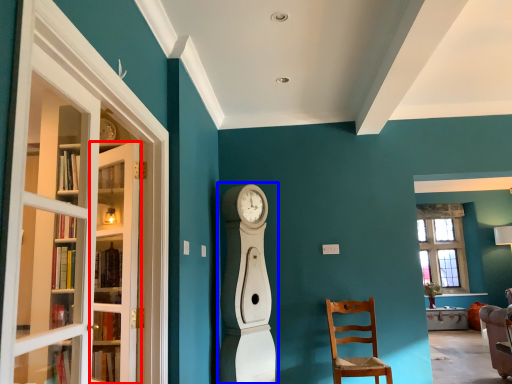
Question: Which of the following is the farthest to the observer, door (highlighted by a red box) or open (highlighted by a blue box)?

Choices:
 (A) door
 (B) open

Answer: (B)